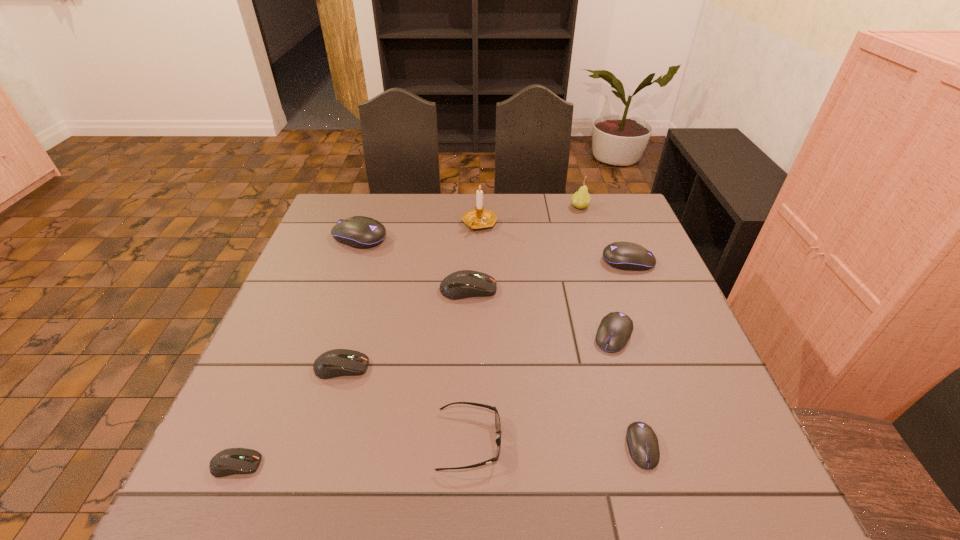
The image size is (960, 540). Find the location of `free space in the image that satisfies the following two spatial constraints: 1. on the button of the rightmost dark computer equipment; 2. on the right side of the fourth nearest computer mouse`. free space in the image that satisfies the following two spatial constraints: 1. on the button of the rightmost dark computer equipment; 2. on the right side of the fourth nearest computer mouse is located at coordinates (467, 335).

You are a GUI agent. You are given a task and a screenshot of the screen. Output one action in this format:
    pyautogui.click(x=<x>, y=<y>)
    Task: Click on the free location that satisfies the following two spatial constraints: 1. on the front side of the candle holder; 2. on the left side of the nearest black computer mouse
    
    Given the screenshot: What is the action you would take?
    pyautogui.click(x=479, y=447)

Locate an element on the screen. free space that satisfies the following two spatial constraints: 1. on the button of the farthest dark computer equipment; 2. on the back side of the second smallest black computer mouse is located at coordinates (467, 335).